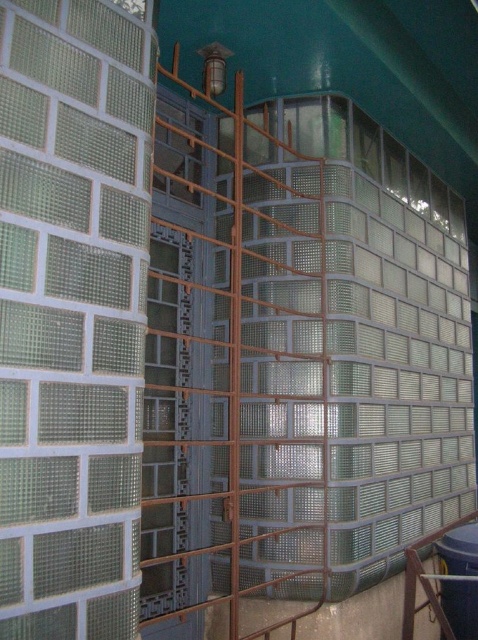
You are standing 3 meters away from the building wall. You want to reach a point on the wall that is marked at coordinates point (237,413). Can you reach it without moving closer than your current position?

The distance of point (237,413) from camera is 2.72 meters. Since you are currently 3 meters away from the wall, you are farther than the point, so you cannot reach it without moving closer.

You are a maintenance worker who needs to reach both the brown metal cage at center and the blue plastic water tank at lower right. Given that your ladder is 4 feet long, will you be able to safely reach both objects from the ground without moving the ladder?

The brown metal cage at center is 4.60 feet from the blue plastic water tank at lower right. Since the ladder is only 4 feet long, it is shorter than the distance between the two objects. Therefore, you will need to move the ladder to reach both objects safely.

You are a maintenance worker inspecting the building exterior. You notice the brown metal cage at center and the blue plastic water tank at lower right. Which object is located higher up on the wall?

The brown metal cage at center is positioned over the blue plastic water tank at lower right, so it is higher up on the wall.